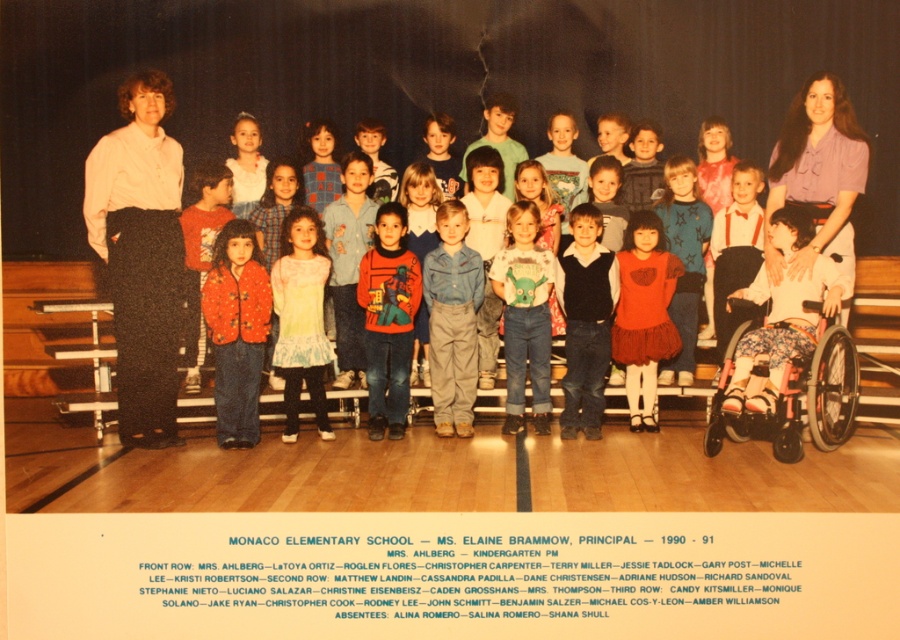
Question: Does matte red sweater at center appear over matte black vest at center?

Choices:
 (A) yes
 (B) no

Answer: (A)

Question: Which point appears closest to the camera in this image?

Choices:
 (A) pos(604,333)
 (B) pos(311,358)

Answer: (B)

Question: Where is floral-patterned jacket at center located in relation to denim pants at center in the image?

Choices:
 (A) below
 (B) above

Answer: (A)

Question: Which point is farther from the camera taking this photo?

Choices:
 (A) (246, 424)
 (B) (783, 433)
 (C) (583, 237)

Answer: (C)

Question: Does matte red sweater at center appear on the right side of matte red dress at center?

Choices:
 (A) yes
 (B) no

Answer: (B)

Question: Which object is the farthest from the matte red sweater at center?

Choices:
 (A) floral fabric wheelchair at lower right
 (B) matte red dress at center

Answer: (A)